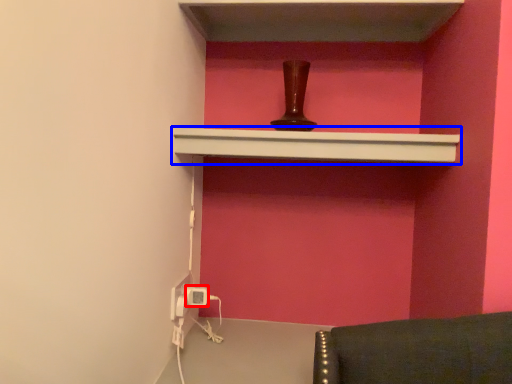
Question: Which of the following is the closest to the observer, electric outlet (highlighted by a red box) or shelf (highlighted by a blue box)?

Choices:
 (A) electric outlet
 (B) shelf

Answer: (B)